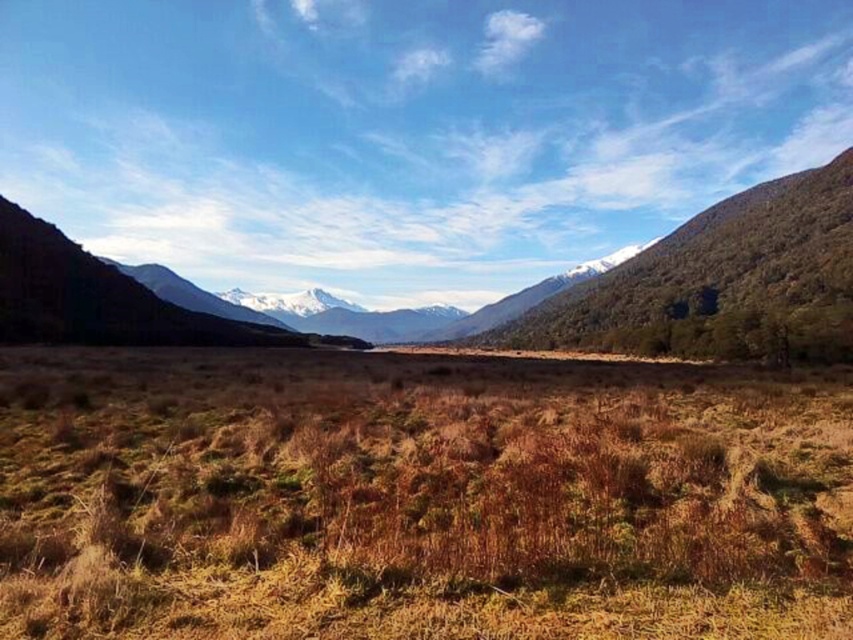
You are a hiker planning to cross the valley. You notice two areas of grass at the center of the image. Which area would be more suitable for walking on, the brown dry grass at center or the green grassy field at center, and why?

The green grassy field at center is more suitable for walking on because it is larger and likely provides a firmer and more stable surface compared to the smaller brown dry grass at center, which may be brittle and less supportive.

You are standing at the base of the valley and see two points marked in the image. Which point is closer to you, point (6, 506) or point (239, 324)?

Point (6, 506) is in front of point (239, 324), so it is closer to you.

You are standing at the edge of the valley and want to cross it to reach the mountains on the other side. You notice two areas of grass in front of you. Which area is narrower, the brown dry grass at center or the green grassy field at center?

The brown dry grass at center is narrower than the green grassy field at center because it has a lesser width compared to the green grassy field at center.